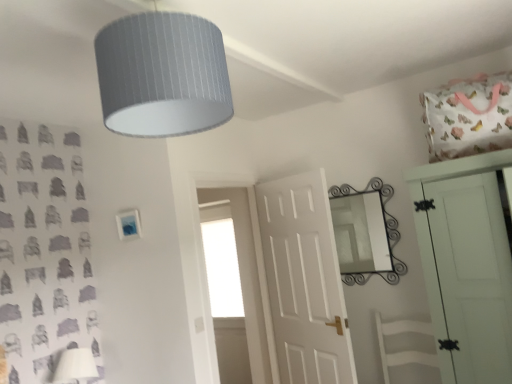
What is the approximate height of textured gray lampshade at upper center?

It is 17.83 inches.

This screenshot has height=384, width=512. What are the coordinates of `transparent glass window at center` in the screenshot? It's located at (222, 266).

The image size is (512, 384). What do you see at coordinates (222, 266) in the screenshot?
I see `transparent glass window at center` at bounding box center [222, 266].

In order to click on white matte door at upper right, which appears as the 2th door when viewed from the left in this screenshot , I will do 468,276.

What is the approximate height of black wrought iron mirror at upper right?

black wrought iron mirror at upper right is 29.29 inches tall.

Locate an element on the screen. The width and height of the screenshot is (512, 384). white matte swivel chair at center is located at coordinates (406, 345).

In the image, is white matte swivel chair at center on the left side or the right side of white matte door at upper right, which appears as the 2th door when viewed from the left?

white matte swivel chair at center is positioned on white matte door at upper right, which appears as the 2th door when viewed from the left,'s left side.

Based on the photo, is white matte swivel chair at center next to white matte door at upper right, positioned as the second door in back-to-front order?

No, white matte swivel chair at center is not with white matte door at upper right, positioned as the second door in back-to-front order.

Find the location of a particular element. door that appears on the right of white matte swivel chair at center is located at coordinates (468, 276).

Is white matte swivel chair at center positioned beyond the bounds of white matte door at upper right, which appears as the 2th door when viewed from the left?

Indeed, white matte swivel chair at center is completely outside white matte door at upper right, which appears as the 2th door when viewed from the left.

At what (x,y) coordinates should I click in order to perform the action: click on lamp lying above the black wrought iron mirror at upper right (from the image's perspective). Please return your answer as a coordinate pair (x, y). Looking at the image, I should click on (162, 75).

Based on their sizes in the image, would you say textured gray lampshade at upper center is bigger or smaller than black wrought iron mirror at upper right?

Considering their sizes, textured gray lampshade at upper center takes up more space than black wrought iron mirror at upper right.

Do you think textured gray lampshade at upper center is within black wrought iron mirror at upper right, or outside of it?

textured gray lampshade at upper center is outside black wrought iron mirror at upper right.

From a real-world perspective, is textured gray lampshade at upper center on top of black wrought iron mirror at upper right?

Yes, from a real-world perspective, textured gray lampshade at upper center is over black wrought iron mirror at upper right

Considering the relative sizes of white matte swivel chair at center and white fabric lampshade at lower left in the image provided, is white matte swivel chair at center smaller than white fabric lampshade at lower left?

No, white matte swivel chair at center is not smaller than white fabric lampshade at lower left.

Could you tell me if white matte swivel chair at center is facing white fabric lampshade at lower left?

No, white matte swivel chair at center is not facing towards white fabric lampshade at lower left.

Is white fabric lampshade at lower left located within white matte swivel chair at center?

No, white fabric lampshade at lower left is not a part of white matte swivel chair at center.

Between point (395, 360) and point (75, 379), which one is positioned behind?

The point (395, 360) is farther from the camera.

Considering the sizes of textured gray lampshade at upper center and white fabric lampshade at lower left in the image, is textured gray lampshade at upper center wider or thinner than white fabric lampshade at lower left?

In the image, textured gray lampshade at upper center appears to be wider than white fabric lampshade at lower left.

Looking at this image, which object is positioned more to the left, textured gray lampshade at upper center or white fabric lampshade at lower left?

Positioned to the left is white fabric lampshade at lower left.

Identify the location of table lamp directly beneath the textured gray lampshade at upper center (from a real-world perspective). The height and width of the screenshot is (384, 512). (75, 366).

Are textured gray lampshade at upper center and white fabric lampshade at lower left far apart?

textured gray lampshade at upper center is positioned a significant distance from white fabric lampshade at lower left.

Which is behind, point (55, 380) or point (398, 356)?

The point (398, 356) is farther from the camera.

Which is behind, white fabric lampshade at lower left or white matte swivel chair at center?

white fabric lampshade at lower left.

Can you confirm if white fabric lampshade at lower left is taller than white matte swivel chair at center?

No.

How different are the orientations of white fabric lampshade at lower left and white matte swivel chair at center in degrees?

There is a 85.2-degree angle between the facing directions of white fabric lampshade at lower left and white matte swivel chair at center.

Is white fabric lampshade at lower left looking in the opposite direction of transparent glass window at center?

No, white fabric lampshade at lower left is not facing away from transparent glass window at center.

Is white fabric lampshade at lower left not within transparent glass window at center?

That's correct, white fabric lampshade at lower left is outside of transparent glass window at center.

Is the depth of white fabric lampshade at lower left less than that of transparent glass window at center?

Yes, the depth of white fabric lampshade at lower left is less than that of transparent glass window at center.

How many degrees apart are the facing directions of black wrought iron mirror at upper right and white matte door at upper right, placed as the first door when sorted from front to back?

The angular difference between black wrought iron mirror at upper right and white matte door at upper right, placed as the first door when sorted from front to back, is 1.18 degrees.

Does black wrought iron mirror at upper right touch white matte door at upper right, which appears as the 2th door when viewed from the left?

No, black wrought iron mirror at upper right is not in contact with white matte door at upper right, which appears as the 2th door when viewed from the left.

From a real-world perspective, is black wrought iron mirror at upper right positioned over white matte door at upper right, placed as the first door when sorted from right to left, based on gravity?

Yes, from a real-world perspective, black wrought iron mirror at upper right is above white matte door at upper right, placed as the first door when sorted from right to left.

Locate an element on the screen. swivel chair below the white matte door at upper right, positioned as the second door in back-to-front order (from a real-world perspective) is located at coordinates (406, 345).

The image size is (512, 384). I want to click on mirror that is on the right side of textured gray lampshade at upper center, so click(x=361, y=233).

From the picture: Looking at the image, which one is located further to white matte door at center, placed as the second door when sorted from front to back, white matte swivel chair at center or black wrought iron mirror at upper right?

white matte swivel chair at center.

Based on their spatial positions, is white matte door at center, which ranks as the first door in left-to-right order, or white matte swivel chair at center further from textured gray lampshade at upper center?

Based on the image, white matte swivel chair at center appears to be further to textured gray lampshade at upper center.

Which object lies further to the anchor point white fabric lampshade at lower left, white matte swivel chair at center or transparent glass window at center?

white matte swivel chair at center is positioned further to the anchor white fabric lampshade at lower left.

From the image, which object appears to be farther from white fabric lampshade at lower left, transparent glass window at center or white matte swivel chair at center?

white matte swivel chair at center lies further to white fabric lampshade at lower left than the other object.

From the image, which object appears to be nearer to white fabric lampshade at lower left, black wrought iron mirror at upper right or white matte door at center, which ranks as the first door in left-to-right order?

Based on the image, white matte door at center, which ranks as the first door in left-to-right order, appears to be nearer to white fabric lampshade at lower left.

Estimate the real-world distances between objects in this image. Which object is further from white matte door at center, acting as the 1th door starting from the back, textured gray lampshade at upper center or transparent glass window at center?

The object further to white matte door at center, acting as the 1th door starting from the back, is textured gray lampshade at upper center.

Based on their spatial positions, is white fabric lampshade at lower left or transparent glass window at center further from white matte door at upper right, placed as the first door when sorted from front to back?

The object further to white matte door at upper right, placed as the first door when sorted from front to back, is transparent glass window at center.

When comparing their distances from white matte door at upper right, placed as the first door when sorted from right to left, does white fabric lampshade at lower left or black wrought iron mirror at upper right seem further?

The object further to white matte door at upper right, placed as the first door when sorted from right to left, is white fabric lampshade at lower left.

Locate an element on the screen. Image resolution: width=512 pixels, height=384 pixels. door positioned between white matte door at upper right, which appears as the 2th door when viewed from the left, and transparent glass window at center from near to far is located at coordinates pos(304,281).

Locate an element on the screen. This screenshot has width=512, height=384. table lamp between textured gray lampshade at upper center and white matte door at center, placed as the second door when sorted from front to back, from front to back is located at coordinates (75, 366).

Identify the location of door between white fabric lampshade at lower left and white matte swivel chair at center. The width and height of the screenshot is (512, 384). (304, 281).

Where is `swivel chair between white matte door at upper right, placed as the first door when sorted from front to back, and transparent glass window at center in the front-back direction`? This screenshot has height=384, width=512. swivel chair between white matte door at upper right, placed as the first door when sorted from front to back, and transparent glass window at center in the front-back direction is located at coordinates (406, 345).